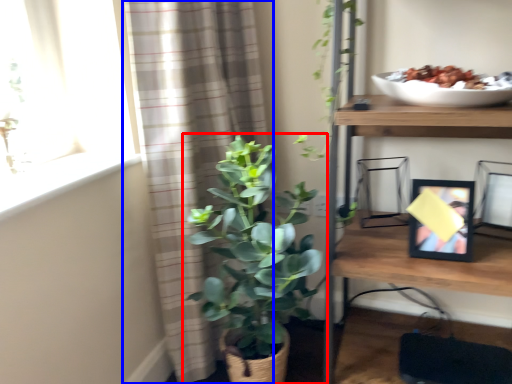
Question: Which of the following is the farthest to the observer, houseplant (highlighted by a red box) or curtain (highlighted by a blue box)?

Choices:
 (A) houseplant
 (B) curtain

Answer: (B)